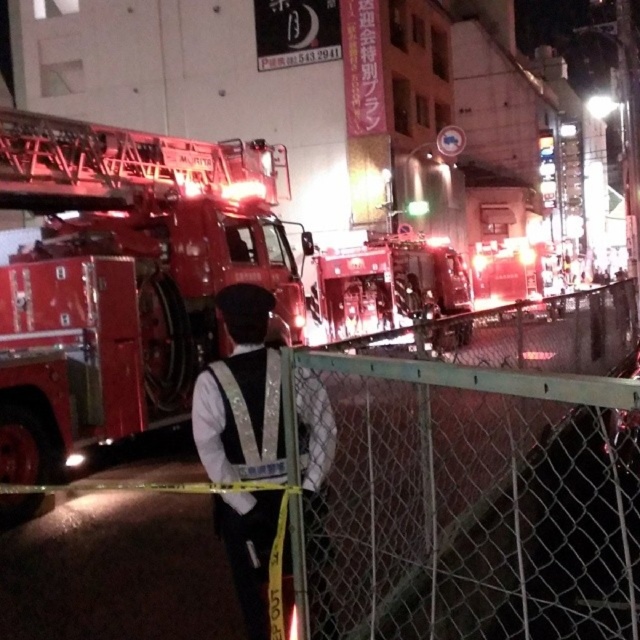
You are a firefighter who needs to quickly access the shiny red fire truck at center. Considering your height is 6 feet and you are standing 10 feet away from the camera, can you safely reach the fire truck without moving closer?

The shiny red fire truck at center is 18.44 feet from the camera. Since you are 10 feet away from the camera, the distance between you and the fire truck is 8.44 feet. Therefore, you can safely reach the fire truck without moving closer as you are already within a reasonable distance.

Looking at this image, you are a firefighter who needs to locate the shiny red fire truck at center and the white reflective vest at center. Based on the scene description, which object is positioned higher in the image?

The shiny red fire truck at center is positioned higher than the white reflective vest at center in the image.